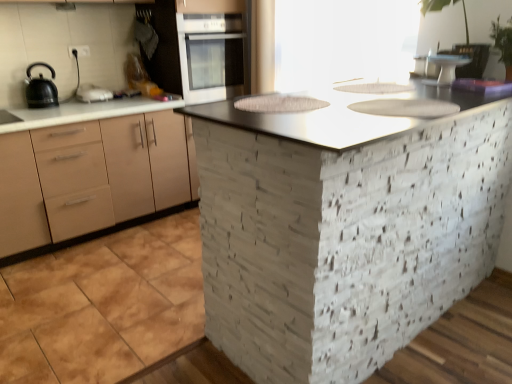
Question: From the image's perspective, is metallic gray countertop at center located above or below black matte kettle at left?

Choices:
 (A) above
 (B) below

Answer: (B)

Question: Based on their sizes in the image, would you say metallic gray countertop at center is bigger or smaller than black matte kettle at left?

Choices:
 (A) small
 (B) big

Answer: (B)

Question: Which of these objects is positioned closest to the metallic gray countertop at center?

Choices:
 (A) matte beige cabinet at left
 (B) transparent glass window screen at upper center
 (C) white glossy cake stand at upper right
 (D) white glossy oven at upper center
 (E) green leafy plant at upper right

Answer: (C)

Question: Which of these objects is positioned closest to the white glossy oven at upper center?

Choices:
 (A) green leafy plant at upper right
 (B) white glossy sink at upper center, the 1th sink in the back-to-front sequence
 (C) matte beige cabinet at left
 (D) white glossy cake stand at upper right
 (E) metallic gray countertop at center

Answer: (C)